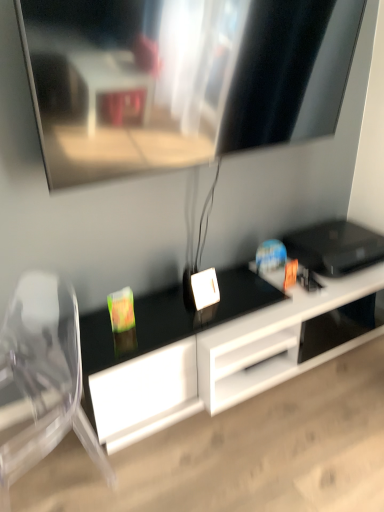
This screenshot has height=512, width=384. In order to click on vacant area that lies in front of black glossy desk at center in this screenshot , I will do `click(271, 455)`.